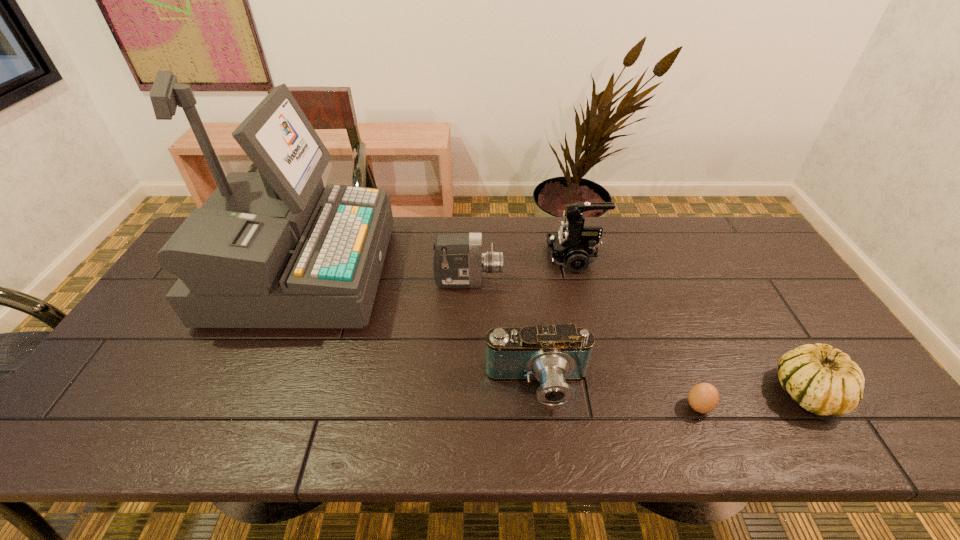
Locate an element on the screen. blank area in the image that satisfies the following two spatial constraints: 1. on the lens mount of the rightmost object; 2. on the right side of the tallest camcorder is located at coordinates (607, 392).

The height and width of the screenshot is (540, 960). Find the location of `free region that satisfies the following two spatial constraints: 1. on the back side of the fifth object from left to right; 2. on the customer-facing side of the leftmost object`. free region that satisfies the following two spatial constraints: 1. on the back side of the fifth object from left to right; 2. on the customer-facing side of the leftmost object is located at coordinates (644, 273).